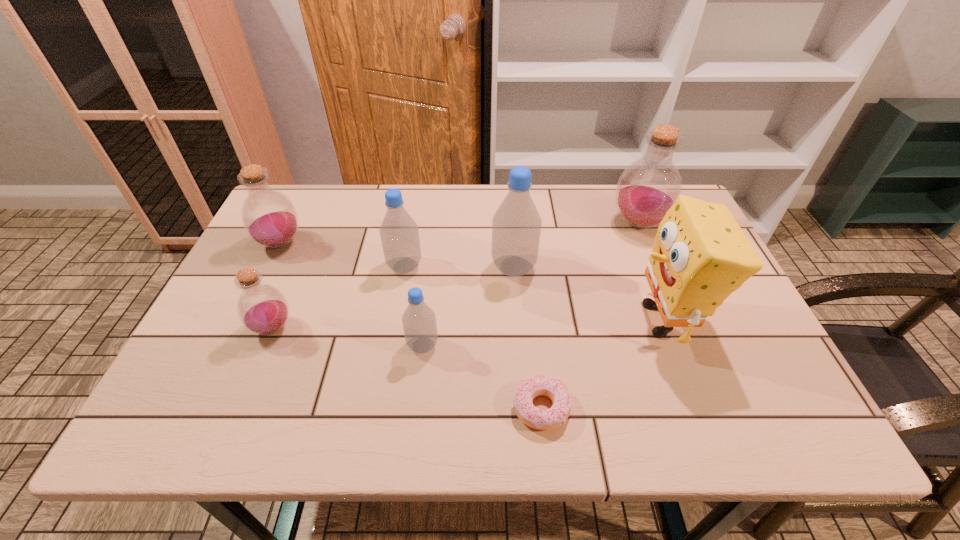
Where is `the rightmost purple bottle`? the rightmost purple bottle is located at coordinates (648, 187).

Image resolution: width=960 pixels, height=540 pixels. I want to click on the biggest purple bottle, so click(x=648, y=187).

Where is `the biggest gray bottle`? The image size is (960, 540). the biggest gray bottle is located at coordinates (516, 225).

Where is `the rightmost gray bottle`? the rightmost gray bottle is located at coordinates (516, 225).

I want to click on yellow sponge, so click(x=700, y=255).

You are a GUI agent. You are given a task and a screenshot of the screen. Output one action in this format:
    pyautogui.click(x=<x>, y=<y>)
    Task: Click on the second smallest purple bottle
    The height and width of the screenshot is (540, 960).
    Given the screenshot: What is the action you would take?
    pyautogui.click(x=269, y=217)

Where is `the second biggest gray bottle`? the second biggest gray bottle is located at coordinates (399, 233).

I want to click on the nearest purple bottle, so click(263, 309).

What are the coordinates of `the smallest gray bottle` in the screenshot? It's located at (419, 323).

At what (x,y) coordinates should I click in order to perform the action: click on the shortest object. Please return your answer as a coordinate pair (x, y). This screenshot has height=540, width=960. Looking at the image, I should click on (555, 389).